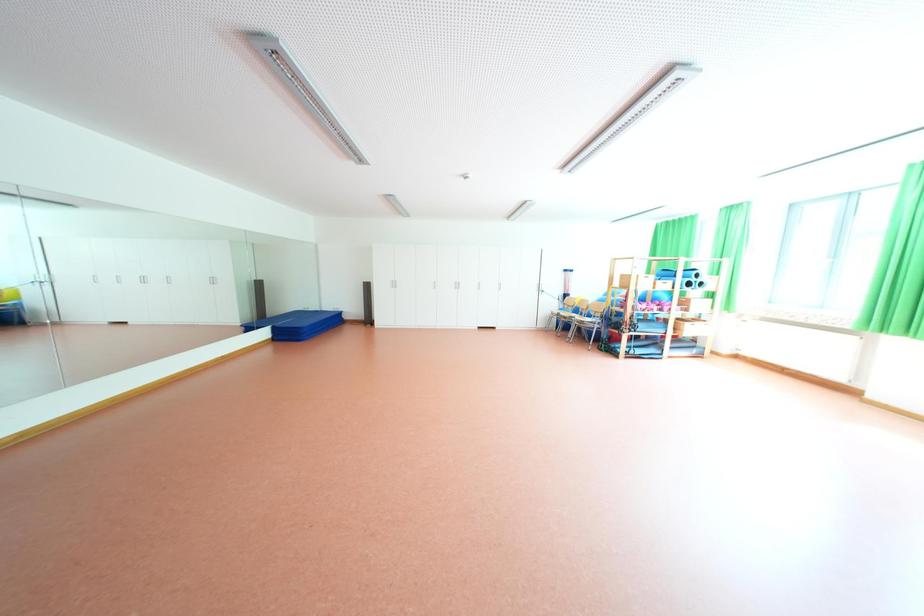
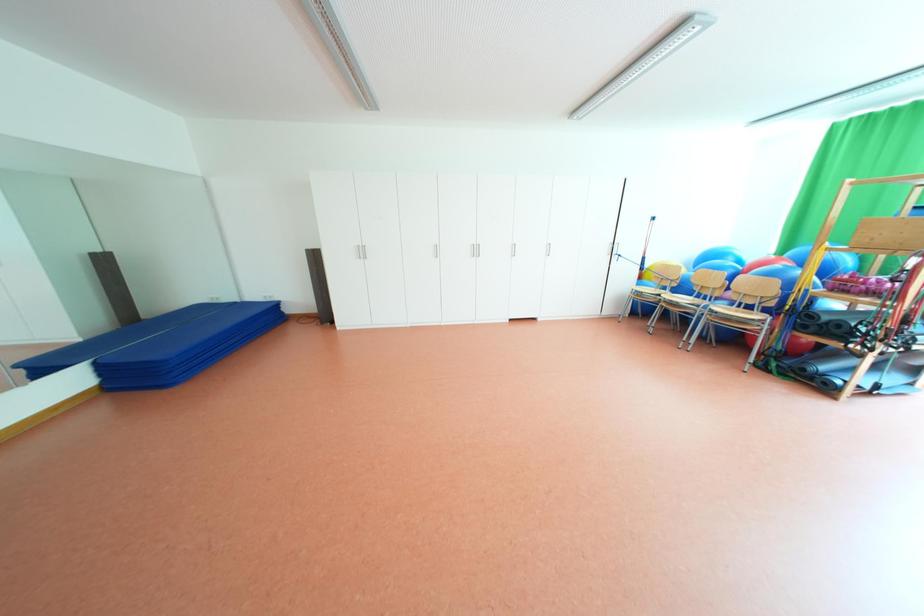
Question: The images are taken continuously from a first-person perspective. In which direction are you moving?

Choices:
 (A) Left
 (B) Right
 (C) Forward
 (D) Backward

Answer: (C)